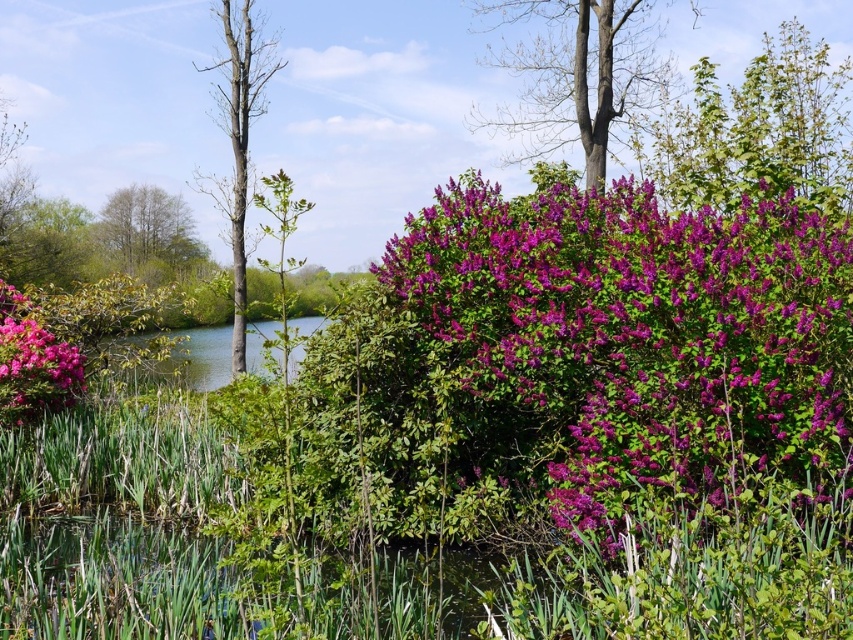
You are an artist planning to paint this landscape. You want to ensure the purple leafy bush at upper right and the smooth bark tree at upper center are proportionally accurate. Which object should you paint larger?

The purple leafy bush at upper right should be painted larger since it has a larger size compared to the smooth bark tree at upper center according to the description.